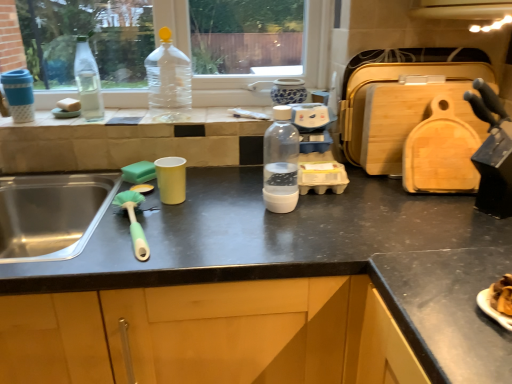
This screenshot has height=384, width=512. What are the coordinates of `unoccupied region to the right of clear glass bottle at left, the 1th bottle from the back` in the screenshot? It's located at (129, 118).